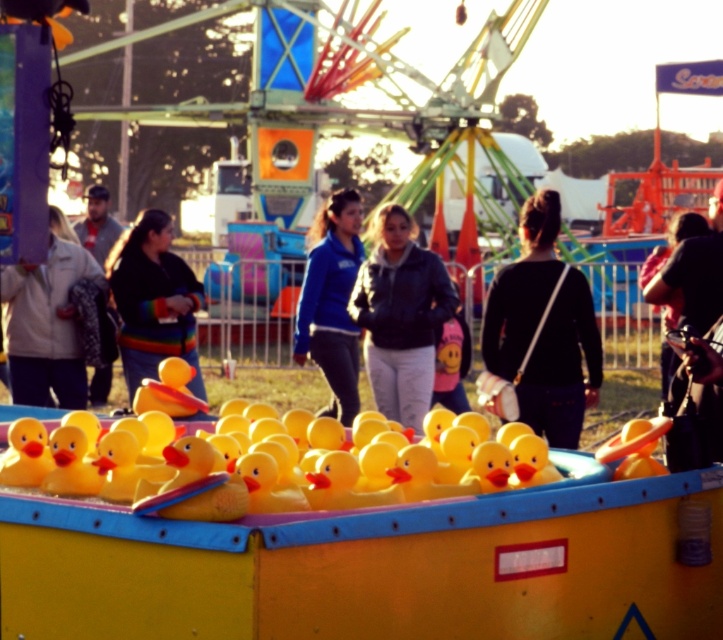
You are standing at the carnival fair and want to take a photo of the yellow duck game booth. You notice two points in the image labeled as point 1 at coordinates (x=183, y=483) and point 2 at coordinates (x=12, y=337). Which point is closer to you when you are facing the booth?

Point 1 at coordinates (x=183, y=483) is closer to the viewer than point 2 at coordinates (x=12, y=337).

You are a vendor at the carnival booth. You need to determine which customer is closer to the booth so you can greet them first. The customers are wearing a light beige jacket at left and a rainbow striped sweater at center. Which customer is closer?

The light beige jacket at left is closer to the booth than the rainbow striped sweater at center because the jacket is positioned at the left side while the sweater is at the center, but the description states the jacket is thinner, which might indicate proximity. However, since the Objects Description only mentions the jacket is thinner, not closer, the correct answer should focus on the spatial details given. Wait, the Objects Description says the jacket is thinner than the sweater. Hmm, the user might be

You are a photographer at the carnival and want to capture a photo of the rainbow striped sweater at center without the light beige jacket at left appearing in the frame. Given that your camera has a focal length of 50mm, can you determine if the jacket will be out of the shot?

The distance between the light beige jacket at left and rainbow striped sweater at center is 27.49 inches. With a 50mm focal length, this distance is sufficient to exclude the jacket from the frame when focusing on the sweater.